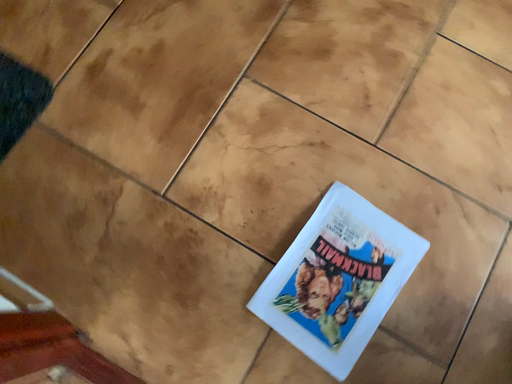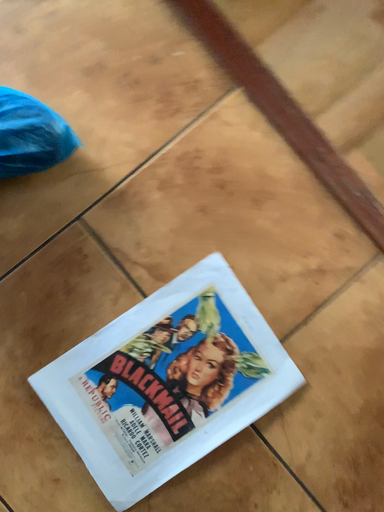
Question: Which way did the camera rotate in the video?

Choices:
 (A) rotated upward
 (B) rotated downward

Answer: (A)